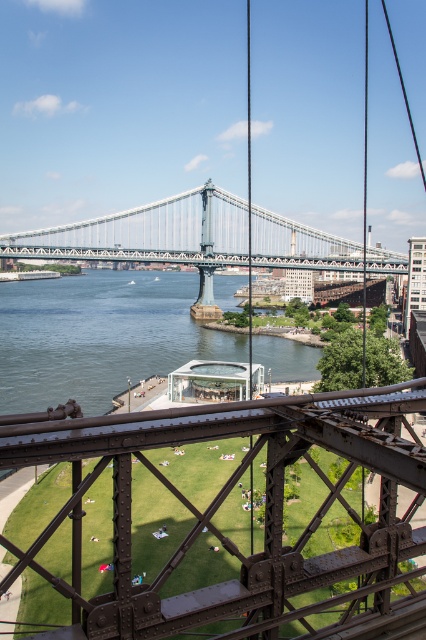
Between point (120, 417) and point (74, 225), which one is positioned in front?

Point (120, 417) is more forward.

Between green grass lawn at center and metallic steel bridge at center, which one appears on the left side from the viewer's perspective?

green grass lawn at center

Locate an element on the screen. green grass lawn at center is located at coordinates (226, 497).